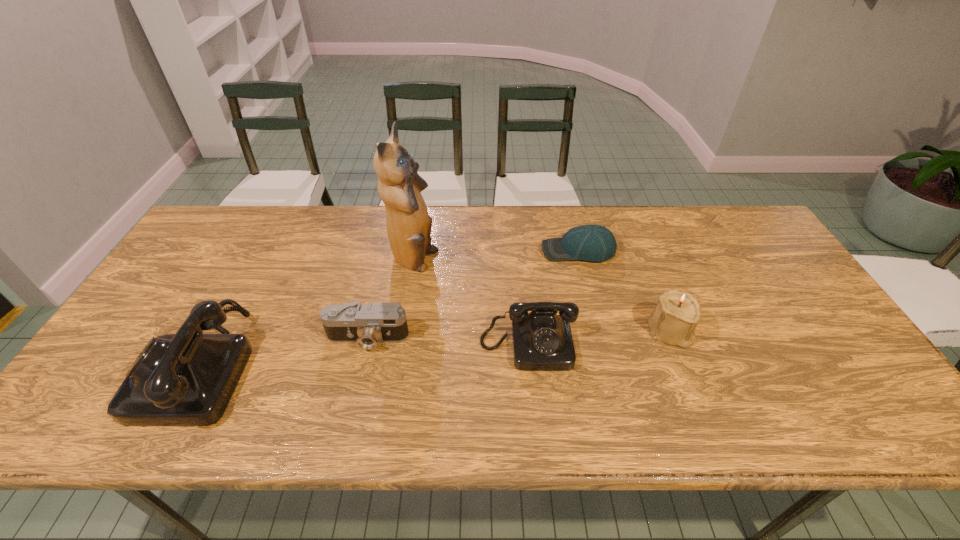
What are the coordinates of `vacant space in between the camera and the baseball cap` in the screenshot? It's located at (473, 294).

Where is `free area in between the taller telephone and the rightmost object`? The image size is (960, 540). free area in between the taller telephone and the rightmost object is located at coordinates (434, 348).

The width and height of the screenshot is (960, 540). What are the coordinates of `the second closest object to the third tallest object` in the screenshot? It's located at (595, 243).

Identify which object is the fifth closest to the baseball cap. Please provide its 2D coordinates. Your answer should be formatted as a tuple, i.e. [(x, y)], where the tuple contains the x and y coordinates of a point satisfying the conditions above.

[(185, 379)]

This screenshot has height=540, width=960. I want to click on free location that satisfies the following two spatial constraints: 1. on the face of the cat; 2. on the lens of the camera, so click(x=401, y=338).

Locate an element on the screen. vacant area that satisfies the following two spatial constraints: 1. on the dial of the fourth tallest object; 2. on the dial of the fifth shortest object is located at coordinates (530, 364).